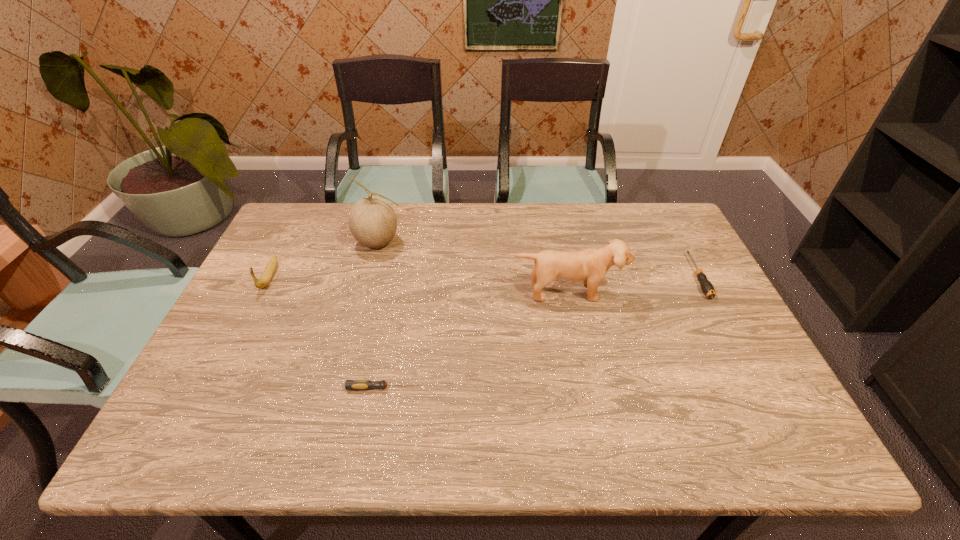
Image resolution: width=960 pixels, height=540 pixels. In the image, there is a desktop. In order to click on vacant space at the far right corner in this screenshot , I will do `click(678, 221)`.

Identify the location of vacant region between the puppy and the left screwdriver. (474, 340).

Identify the location of empty space that is in between the puppy and the cantaloup. (472, 267).

I want to click on vacant space in between the third shortest object and the right screwdriver, so click(x=484, y=276).

The width and height of the screenshot is (960, 540). Identify the location of vacant space in between the second object from right to left and the cantaloup. (472, 267).

Locate an element on the screen. The width and height of the screenshot is (960, 540). blank region between the leftmost object and the taller screwdriver is located at coordinates (484, 276).

Image resolution: width=960 pixels, height=540 pixels. In order to click on vacant space that is in between the fourth tallest object and the fourth object from left to right in this screenshot , I will do `click(632, 285)`.

Identify the location of vacant space in between the fourth object from left to right and the right screwdriver. (632, 285).

Where is `empty space between the banana and the shortest object`? The image size is (960, 540). empty space between the banana and the shortest object is located at coordinates (326, 332).

Identify the location of object that ranks as the fourth closest to the nearer screwdriver. Image resolution: width=960 pixels, height=540 pixels. (707, 288).